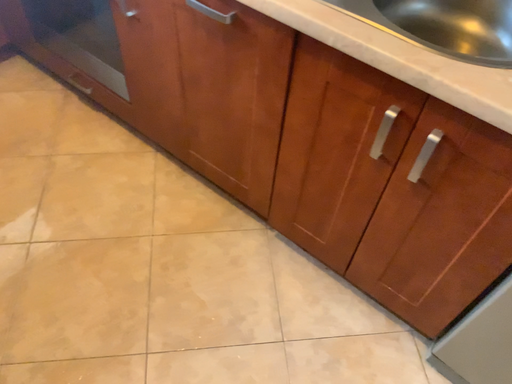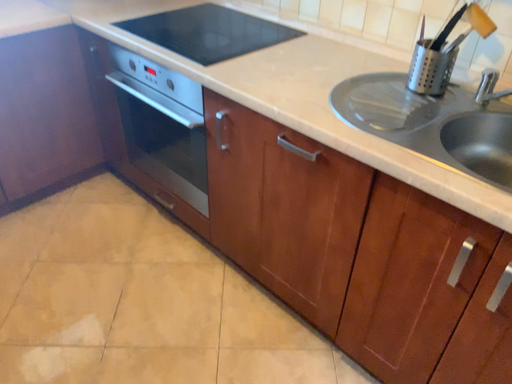
Question: Which way did the camera rotate in the video?

Choices:
 (A) rotated downward
 (B) rotated upward

Answer: (B)